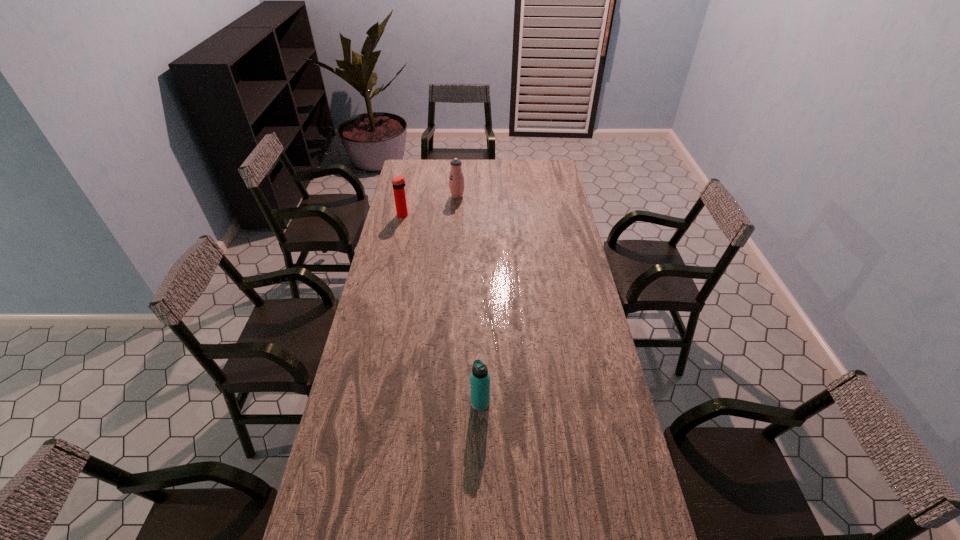
Find the location of a particular element. The height and width of the screenshot is (540, 960). vacant area that lies between the farthest thermos bottle and the rightmost object is located at coordinates (468, 299).

Identify the location of object that is the closest to the nearest thermos bottle. (398, 182).

Identify which object is the nearest to the second farthest object. Please provide its 2D coordinates. Your answer should be formatted as a tuple, i.e. [(x, y)], where the tuple contains the x and y coordinates of a point satisfying the conditions above.

[(456, 179)]

Choose which thermos bottle is the second nearest neighbor to the leftmost object. Please provide its 2D coordinates. Your answer should be formatted as a tuple, i.e. [(x, y)], where the tuple contains the x and y coordinates of a point satisfying the conditions above.

[(480, 378)]

Select which thermos bottle appears as the second closest to the second nearest object. Please provide its 2D coordinates. Your answer should be formatted as a tuple, i.e. [(x, y)], where the tuple contains the x and y coordinates of a point satisfying the conditions above.

[(480, 378)]

This screenshot has width=960, height=540. I want to click on blank space that satisfies the following two spatial constraints: 1. on the back side of the farthest object; 2. on the left side of the second nearest object, so click(x=408, y=196).